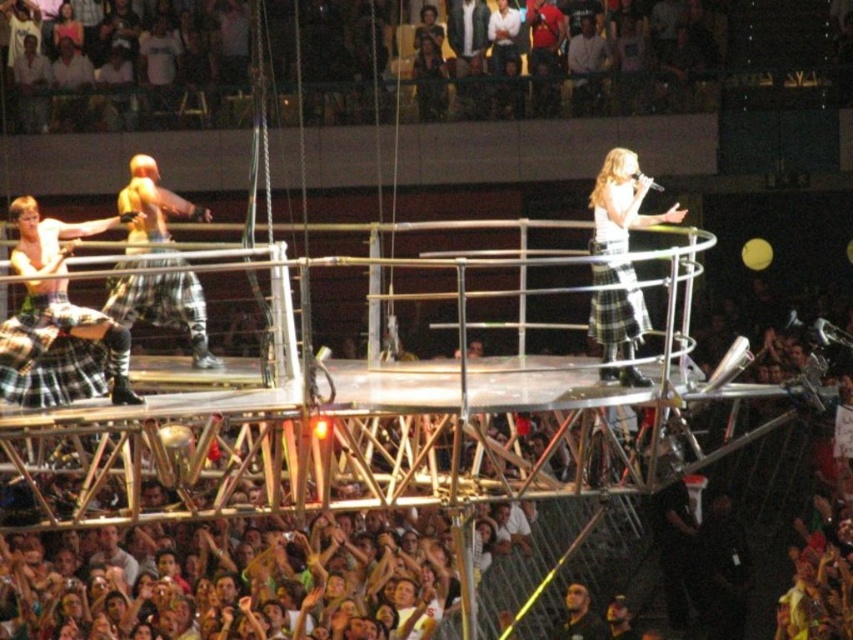
You are a photographer at the concert trying to capture a shot of both the matte plaid kilt at center and the dark brown leather jacket at lower center. Since you can only focus on one subject at a time, which one should you focus on to ensure the other is still in the background?

The matte plaid kilt at center is located above dark brown leather jacket at lower center, so focusing on the matte plaid kilt at center will keep the dark brown leather jacket at lower center in the background.

You are a photographer at the concert and need to capture both the plaid skirt at center and the matte plaid kilt at center in a single shot. Which one should you focus on first to ensure it appears larger in the photo?

The matte plaid kilt at center should be focused on first because it has a greater height than the plaid skirt at center, making it naturally larger in the photo.